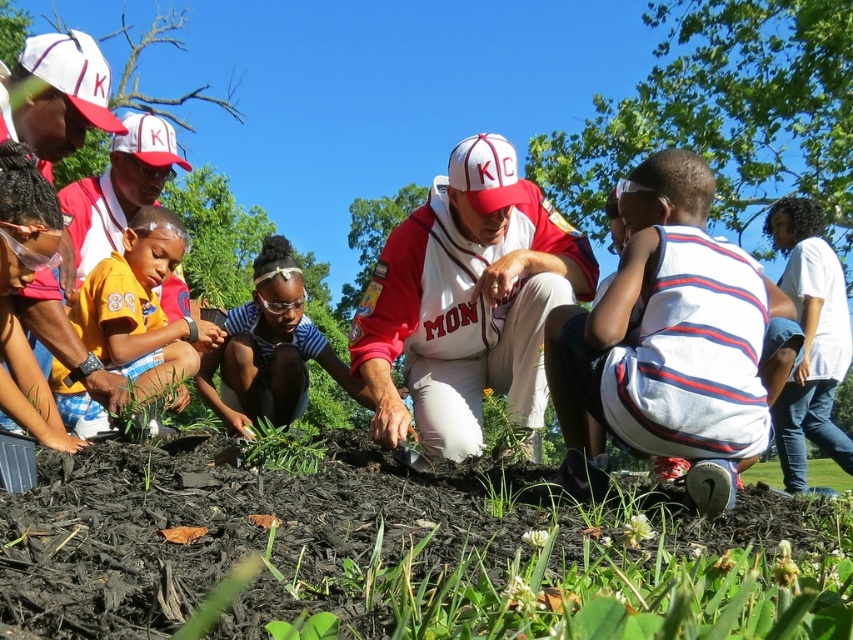
You are standing in the community garden and want to take a photo of the white cotton shirt at center. To avoid blocking the green leafy tree at upper center in the background, which direction should you move?

Move to the left so the white cotton shirt at center is positioned to the right of the green leafy tree at upper center, avoiding blocking it.

You are standing in the community garden and want to take a photo of the green leafy tree at upper center. Where should you position yourself to ensure the tree is centered in your camera frame?

Position yourself directly in front of the green leafy tree at upper center, aligning your camera with its central point at coordinates approximately 0.180 on the horizontal axis and 0.852 on the vertical axis to center it in the frame.

You are a photographer trying to capture a clear shot of the green leafy plant at center without any obstruction. Considering the white cotton shirt at center is in the way, can you determine if the plant will be visible in your photo?

The white cotton shirt at center is larger in size than green leafy plant at center, so the shirt may obstruct the view of the plant, making it less visible or completely blocked in the photo.